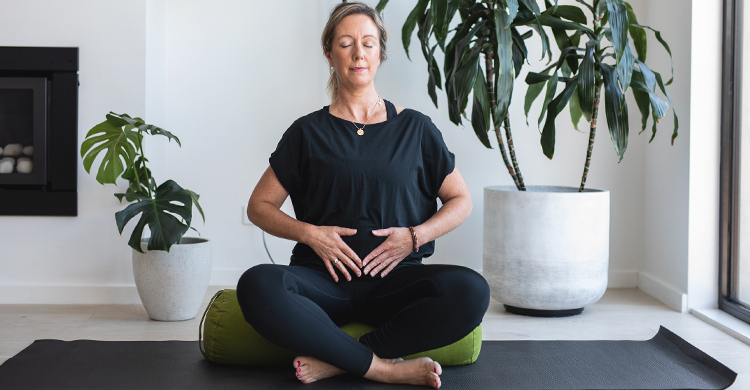
Image resolution: width=750 pixels, height=390 pixels. I want to click on black yoga mat, so click(627, 373).